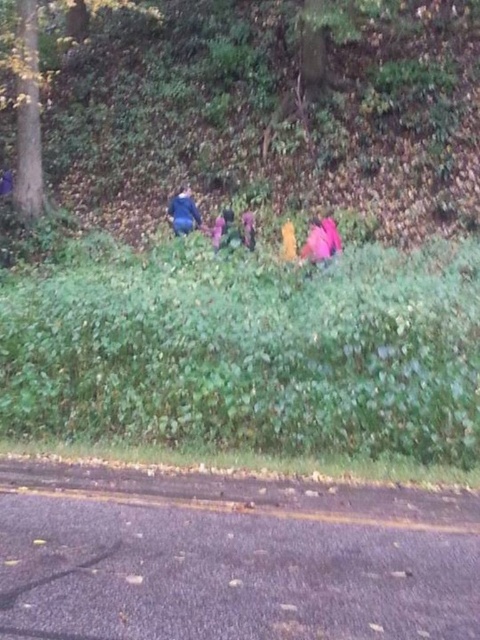
You are standing on the paved road with the yellow dividing line in front of you. There is green leafy vegetation at center marked by point (252, 353). If you walk straight ahead, will you eventually reach the vegetation marked by that point?

Yes, the green leafy vegetation at center is represented by point (252, 353), so walking straight ahead on the paved road with the yellow dividing line will lead you towards that point.

You are a photographer trying to capture a photo of the blue fabric jacket at upper center without the green matte tree at upper left blocking it. Based on their sizes, is it possible to frame the shot so the tree doesn

The green matte tree at upper left is much taller than the blue fabric jacket at upper center, so if the tree is positioned in front of the jacket, it might block the view. However, if the jacket is positioned behind the tree or to the side, you could avoid the obstruction. Adjust your angle or position to ensure the tree doesn

You are a photographer trying to capture a clear shot of the green leafy vegetation at center and the green matte tree at upper left. Which object should you focus on first to ensure both are in focus?

You should focus on the green leafy vegetation at center first since it is closer to the viewer than the green matte tree at upper left, allowing for better depth of field coverage.